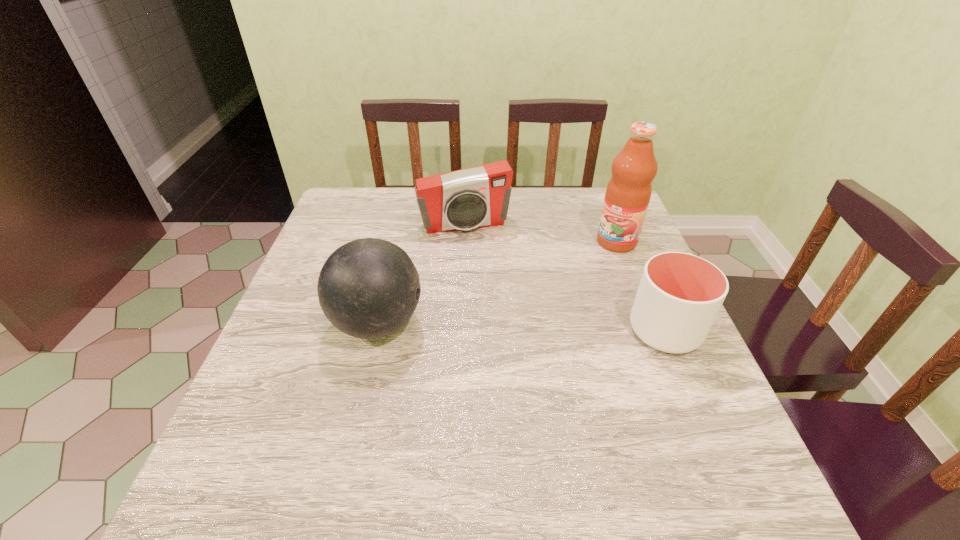
Find the location of `vacant space on the desktop that is between the bowling ball and the cup and is positioned on the front label of the tallest object`. vacant space on the desktop that is between the bowling ball and the cup and is positioned on the front label of the tallest object is located at coordinates (499, 326).

Where is `vacant space on the desktop that is between the third shortest object and the cup and is positioned on the front-facing side of the camera`? vacant space on the desktop that is between the third shortest object and the cup and is positioned on the front-facing side of the camera is located at coordinates (496, 326).